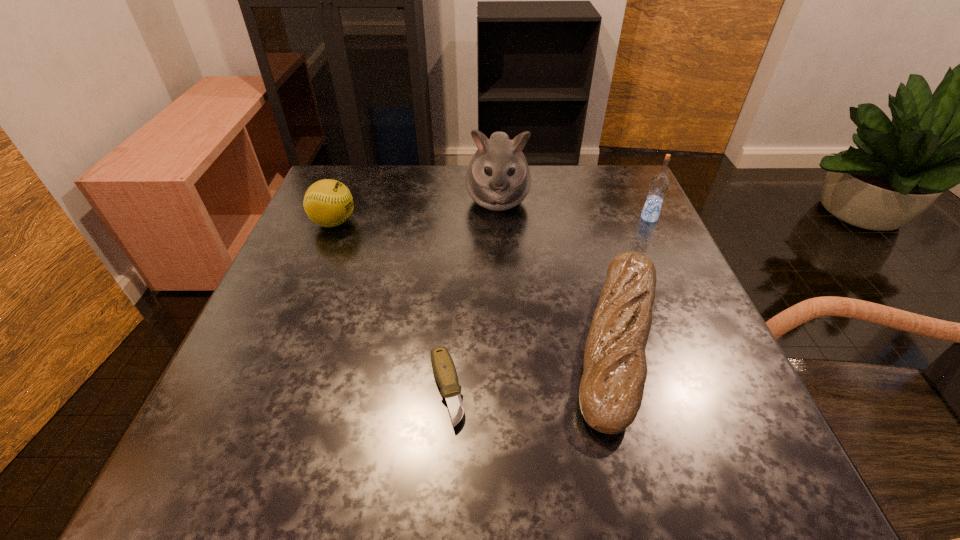
Where is `vacant space that's between the vodka and the hamster`? This screenshot has width=960, height=540. vacant space that's between the vodka and the hamster is located at coordinates (573, 209).

I want to click on unoccupied position between the pocketknife and the leftmost object, so click(x=391, y=306).

Where is `unoccupied area between the third tallest object and the hamster`? This screenshot has height=540, width=960. unoccupied area between the third tallest object and the hamster is located at coordinates (416, 211).

Identify the location of vacant area that lies between the hamster and the shortest object. (472, 294).

Identify the location of free area in between the shortest object and the softball. (391, 306).

Where is `blank region between the hamster and the vodka`? Image resolution: width=960 pixels, height=540 pixels. blank region between the hamster and the vodka is located at coordinates (573, 209).

What are the coordinates of `free spot between the hamster and the pocketknife` in the screenshot? It's located at (472, 294).

This screenshot has width=960, height=540. I want to click on vacant region between the rightmost object and the third shortest object, so [x=492, y=220].

Point out which object is positioned as the third nearest to the hamster. Please provide its 2D coordinates. Your answer should be formatted as a tuple, i.e. [(x, y)], where the tuple contains the x and y coordinates of a point satisfying the conditions above.

[(659, 184)]

I want to click on object that can be found as the fourth closest to the hamster, so click(444, 370).